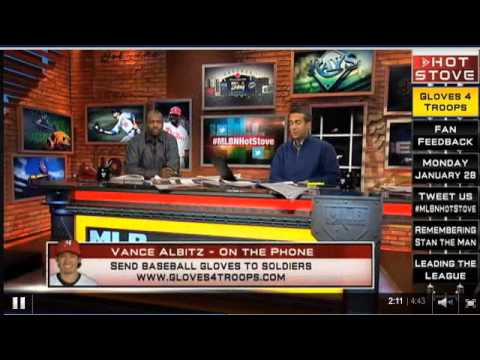
Locate an element on the screen. Image resolution: width=480 pixels, height=360 pixels. back wall of studio is located at coordinates (43, 81), (120, 85), (174, 82), (282, 68), (380, 67).